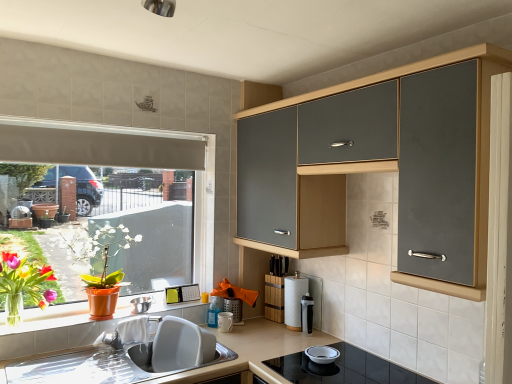
You are a GUI agent. You are given a task and a screenshot of the screen. Output one action in this format:
    pyautogui.click(x=<x>, y=<y>)
    Task: Click on the free space underneath matte gray cabinet at upper right (from a real-world perspective)
    
    Given the screenshot: What is the action you would take?
    pos(326,346)